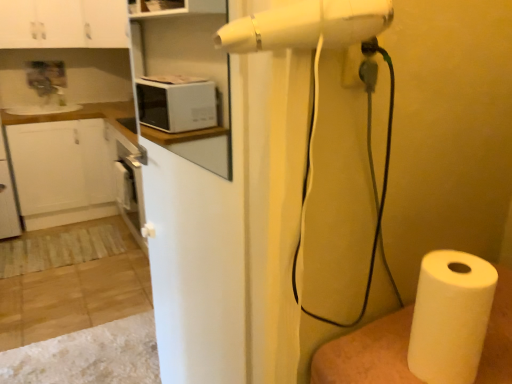
Image resolution: width=512 pixels, height=384 pixels. What do you see at coordinates (85, 117) in the screenshot? I see `white matte countertop at left` at bounding box center [85, 117].

Measure the distance between point [5,125] and camera.

Point [5,125] is 10.22 feet from camera.

Identify the location of white paper at lower right. Image resolution: width=512 pixels, height=384 pixels. (450, 317).

What is the approximate width of white paper at lower right?

The width of white paper at lower right is 5.43 inches.

At what (x,y) coordinates should I click in order to perform the action: click on white matte screen door at center. Please return your answer as a coordinate pair (x, y). This screenshot has height=384, width=512. Looking at the image, I should click on (195, 202).

Are white glossy cabinet at upper left, which is the first cabinetry in right-to-left order, and white matte microwave at upper left located far from each other?

No, white glossy cabinet at upper left, which is the first cabinetry in right-to-left order, is in close proximity to white matte microwave at upper left.

Is point (86, 41) positioned behind point (190, 79)?

Yes, it is behind point (190, 79).

Can you confirm if white glossy cabinet at upper left, arranged as the 2th cabinetry when viewed from the left, is wider than white matte microwave at upper left?

Yes.

From the image's perspective, relative to white matte microwave at upper left, is white glossy cabinet at upper left, which is the first cabinetry in right-to-left order, above or below?

Based on their image positions, white glossy cabinet at upper left, which is the first cabinetry in right-to-left order, is located above white matte microwave at upper left.

From a real-world perspective, which object rests below the other?

white paper at lower right, from a real-world perspective.

Measure the distance between white matte microwave at upper left and white paper at lower right.

A distance of 7.63 feet exists between white matte microwave at upper left and white paper at lower right.

Is white matte microwave at upper left in contact with white paper at lower right?

No, white matte microwave at upper left is not next to white paper at lower right.

In the scene shown: Could white paper at lower right be considered to be inside white matte microwave at upper left?

Definitely not — white paper at lower right is not inside white matte microwave at upper left.

Could you tell me if white matte microwave at upper left is facing white matte countertop at left?

No, white matte microwave at upper left does not turn towards white matte countertop at left.

Can we say white matte microwave at upper left lies outside white matte countertop at left?

That's correct, white matte microwave at upper left is outside of white matte countertop at left.

Considering the relative sizes of white matte microwave at upper left and white matte countertop at left in the image provided, is white matte microwave at upper left wider than white matte countertop at left?

Incorrect, the width of white matte microwave at upper left does not surpass that of white matte countertop at left.

Which is behind, point (226, 20) or point (6, 120)?

The point (6, 120) is farther.

From a real-world perspective, is white paper at lower right positioned under white glossy cabinet at upper left, placed as the second cabinetry when sorted from right to left, based on gravity?

Yes, from a real-world perspective, white paper at lower right is under white glossy cabinet at upper left, placed as the second cabinetry when sorted from right to left.

Does white paper at lower right appear on the left side of white glossy cabinet at upper left, which ranks as the 1th cabinetry in left-to-right order?

In fact, white paper at lower right is to the right of white glossy cabinet at upper left, which ranks as the 1th cabinetry in left-to-right order.

Is white paper at lower right facing away from white glossy cabinet at upper left, which ranks as the 1th cabinetry in left-to-right order?

No, white paper at lower right is not facing away from white glossy cabinet at upper left, which ranks as the 1th cabinetry in left-to-right order.

Is point (423, 303) more distant than point (4, 31)?

No, it is not.

Could you tell me if white glossy cabinet at upper left, placed as the second cabinetry when sorted from right to left, is turned towards white matte countertop at left?

No, white glossy cabinet at upper left, placed as the second cabinetry when sorted from right to left, is not turned towards white matte countertop at left.

Which object is thinner, white glossy cabinet at upper left, placed as the second cabinetry when sorted from right to left, or white matte countertop at left?

white glossy cabinet at upper left, placed as the second cabinetry when sorted from right to left, is thinner.

What's the angular difference between white glossy cabinet at upper left, which ranks as the 1th cabinetry in left-to-right order, and white matte countertop at left's facing directions?

white glossy cabinet at upper left, which ranks as the 1th cabinetry in left-to-right order, and white matte countertop at left are facing 0.000455 degrees away from each other.

From the image's perspective, is white glossy cabinet at upper left, placed as the second cabinetry when sorted from right to left, under white matte countertop at left?

No, from the image's perspective, white glossy cabinet at upper left, placed as the second cabinetry when sorted from right to left, is not below white matte countertop at left.

From a real-world perspective, is white matte microwave at upper left located higher than white paper at lower right?

Yes.

In the scene shown: Is white paper at lower right surrounded by white matte microwave at upper left?

No, white paper at lower right is not inside white matte microwave at upper left.

Is point (152, 140) closer or farther from the camera than point (394, 336)?

Point (152, 140).

Who is bigger, white matte microwave at upper left or white paper at lower right?

white paper at lower right is bigger.

Is white matte screen door at center not inside white glossy cabinet at upper left, arranged as the 2th cabinetry when viewed from the left?

Absolutely, white matte screen door at center is external to white glossy cabinet at upper left, arranged as the 2th cabinetry when viewed from the left.

Is white glossy cabinet at upper left, which is the first cabinetry in right-to-left order, at the back of white matte screen door at center?

white matte screen door at center is not turned away from white glossy cabinet at upper left, which is the first cabinetry in right-to-left order.

Are white matte screen door at center and white glossy cabinet at upper left, which is the first cabinetry in right-to-left order, located far from each other?

They are positioned close to each other.

Considering the relative positions of white matte screen door at center and white glossy cabinet at upper left, which is the first cabinetry in right-to-left order, in the image provided, is white matte screen door at center in front of white glossy cabinet at upper left, which is the first cabinetry in right-to-left order,?

Yes, white matte screen door at center is closer to the viewer.

The height and width of the screenshot is (384, 512). I want to click on cabinetry that is the 2nd one when counting upward from the white matte microwave at upper left (from the image's perspective), so click(x=105, y=23).

Locate an element on the screen. The height and width of the screenshot is (384, 512). shelf that is behind the white paper at lower right is located at coordinates (183, 80).

Looking at this image, based on their spatial positions, is white glossy cabinet at upper left, which ranks as the 1th cabinetry in left-to-right order, or white matte screen door at center closer to white matte microwave at upper left?

white matte screen door at center is closer to white matte microwave at upper left.

From the image, which object appears to be farther from white paper at lower right, white paper at lower right or white matte screen door at center?

white matte screen door at center.

Looking at the image, which one is located closer to white paper at lower right, white matte countertop at left or white matte microwave at upper left?

white matte microwave at upper left lies closer to white paper at lower right than the other object.

Considering their positions, is white glossy cabinet at upper left, placed as the second cabinetry when sorted from right to left, positioned closer to white paper at lower right than white matte countertop at left?

The object closer to white paper at lower right is white matte countertop at left.

Consider the image. Which object lies further to the anchor point white paper at lower right, white matte microwave at upper left or white glossy cabinet at upper left, arranged as the 2th cabinetry when viewed from the left?

white glossy cabinet at upper left, arranged as the 2th cabinetry when viewed from the left, is further to white paper at lower right.

When comparing their distances from white paper at lower right, does white matte countertop at left or white glossy cabinet at upper left, placed as the second cabinetry when sorted from right to left, seem closer?

white matte countertop at left.

Looking at the image, which one is located closer to white paper at lower right, white matte screen door at center or white glossy cabinet at upper left, arranged as the 2th cabinetry when viewed from the left?

white matte screen door at center lies closer to white paper at lower right than the other object.

Which object lies further to the anchor point white paper at lower right, white paper at lower right or white matte countertop at left?

The object further to white paper at lower right is white matte countertop at left.

You are a GUI agent. You are given a task and a screenshot of the screen. Output one action in this format:
    pyautogui.click(x=<x>, y=<y>)
    Task: Click on the shelf positioned between white paper at lower right and white glossy cabinet at upper left, which is the first cabinetry in right-to-left order, from near to far
    This screenshot has height=384, width=512.
    Given the screenshot: What is the action you would take?
    pyautogui.click(x=183, y=80)

Where is `cabinetry between white paper at lower right and white matte countertop at left in the front-back direction`? cabinetry between white paper at lower right and white matte countertop at left in the front-back direction is located at coordinates (63, 24).

This screenshot has width=512, height=384. What are the coordinates of `paper towel between white matte microwave at upper left and white paper at lower right in the vertical direction` in the screenshot? It's located at (450, 317).

You are a GUI agent. You are given a task and a screenshot of the screen. Output one action in this format:
    pyautogui.click(x=<x>, y=<y>)
    Task: Click on the cabinetry between white paper at lower right and white matte countertop at left along the z-axis
    
    Given the screenshot: What is the action you would take?
    pyautogui.click(x=63, y=24)